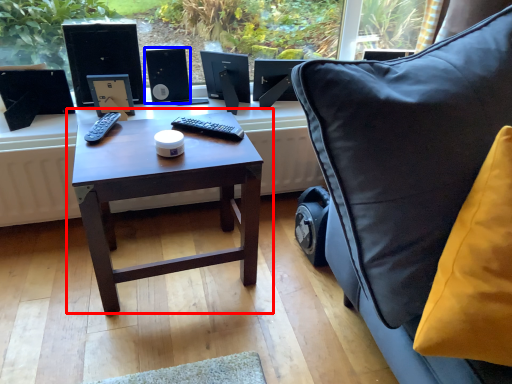
Question: Which of the following is the farthest to the observer, table (highlighted by a red box) or speaker (highlighted by a blue box)?

Choices:
 (A) table
 (B) speaker

Answer: (B)